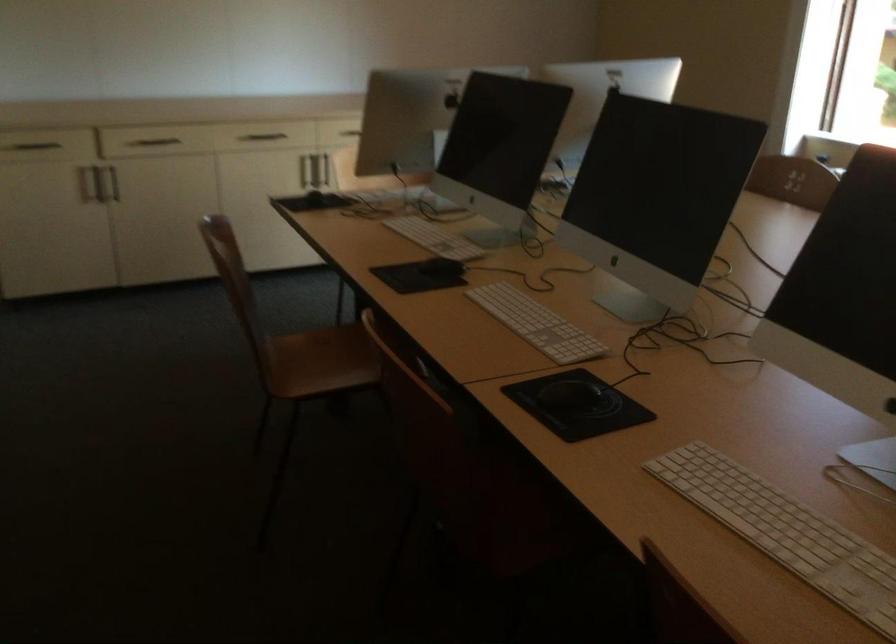
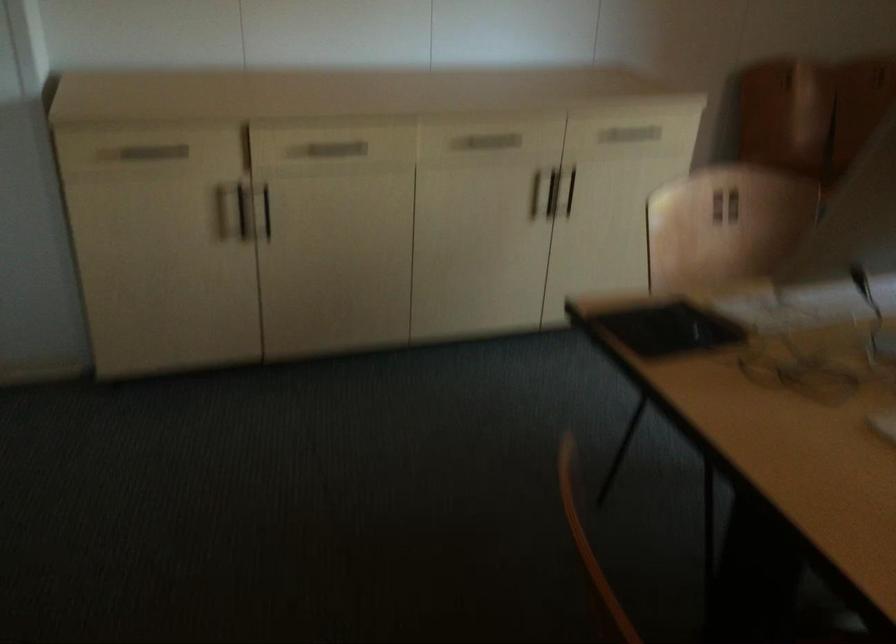
The point at (90, 174) is marked in the first image. Where is the corresponding point in the second image?

(243, 211)